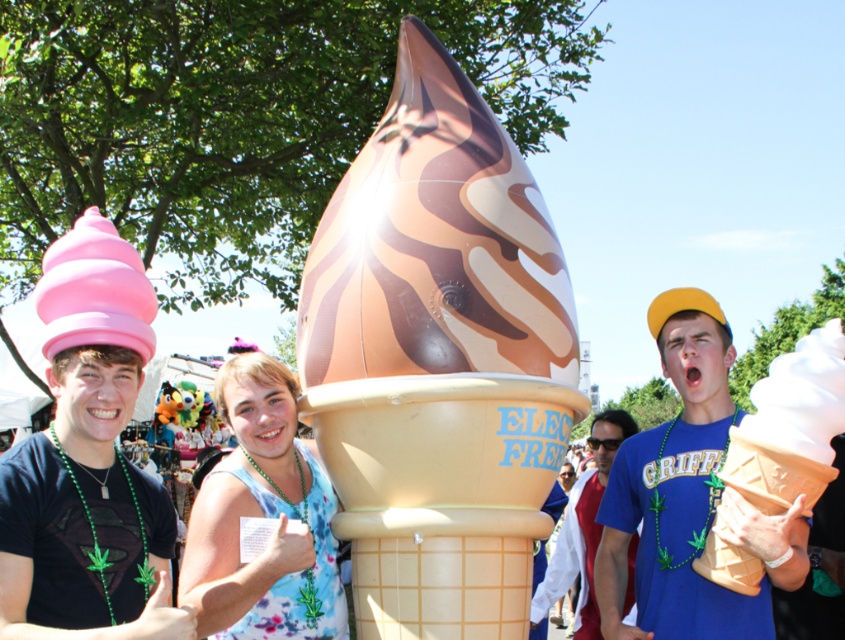
Question: Does pink matte ice cream cone at left have a larger size compared to blue fabric shirt at center?

Choices:
 (A) yes
 (B) no

Answer: (B)

Question: Estimate the real-world distances between objects in this image. Which object is closer to the pink matte ice cream cone at left?

Choices:
 (A) matte blue t-shirt at center
 (B) floral fabric dress at center

Answer: (B)

Question: Which of the following is the closest to the observer?

Choices:
 (A) pink matte ice cream cone at left
 (B) matte blue t-shirt at center
 (C) zebra-patterned plastic ice cream cone at center

Answer: (A)

Question: Which point is farther to the camera?

Choices:
 (A) zebra-patterned plastic ice cream cone at center
 (B) matte blue t-shirt at center
 (C) floral fabric dress at center

Answer: (A)

Question: Does matte blue t-shirt at center have a larger size compared to white matte ice cream cone at right?

Choices:
 (A) no
 (B) yes

Answer: (B)

Question: Can you confirm if zebra-patterned plastic ice cream cone at center is positioned below blue fabric shirt at center?

Choices:
 (A) yes
 (B) no

Answer: (B)